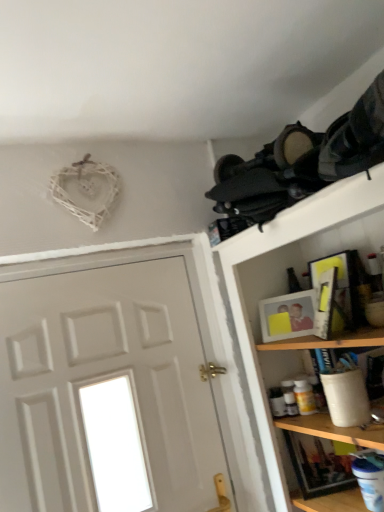
Question: Does point (261, 313) appear closer or farther from the camera than point (205, 424)?

Choices:
 (A) closer
 (B) farther

Answer: (A)

Question: Is matte white picture frame at upper right, the first picture frame from the back, bigger or smaller than white painted wood door at left?

Choices:
 (A) big
 (B) small

Answer: (B)

Question: Based on their relative distances, which object is farther from the wooden shelf at upper right?

Choices:
 (A) white painted wood door at left
 (B) matte yellow picture frame at upper right, the 2th picture frame when ordered from back to front
 (C) matte white picture frame at upper right, the first picture frame from the back
 (D) black fabric backpacks at upper right

Answer: (A)

Question: Which of these objects is positioned farthest from the black fabric backpacks at upper right?

Choices:
 (A) wooden shelf at upper right
 (B) matte yellow picture frame at upper right, which appears as the 1th picture frame when viewed from the front
 (C) matte white picture frame at upper right, the second picture frame viewed from the front
 (D) white painted wood door at left

Answer: (D)